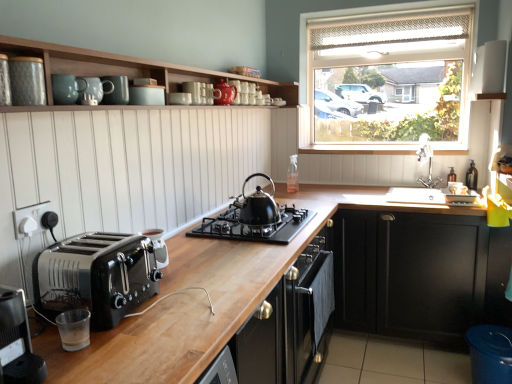
You are a GUI agent. You are given a task and a screenshot of the screen. Output one action in this format:
    pyautogui.click(x=<x>, y=<y>)
    Task: Click on the empty space that is ontop of white textured roller blind at upper right (from a real-world perspective)
    
    Given the screenshot: What is the action you would take?
    pyautogui.click(x=391, y=4)